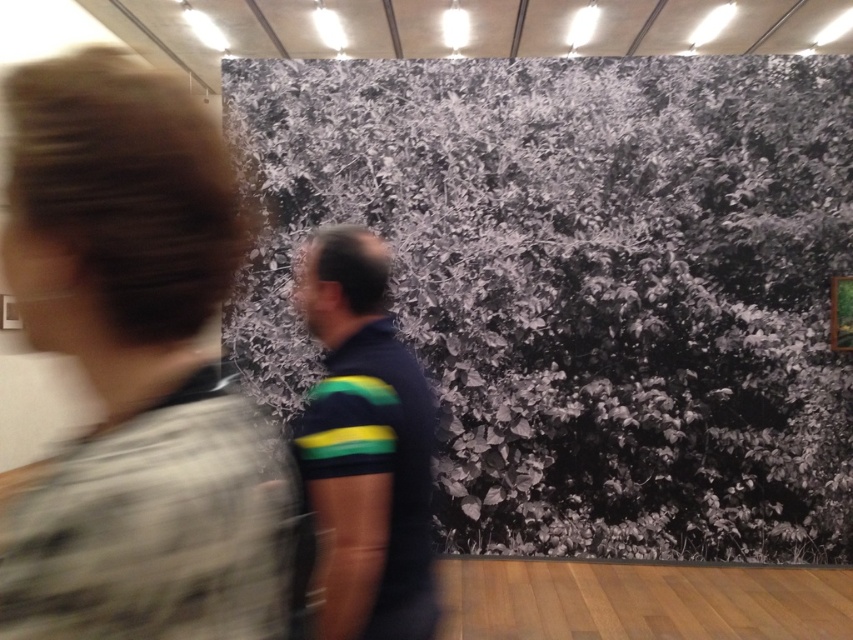
Does blurred hair at center appear under striped polo shirt at center?

No, blurred hair at center is not below striped polo shirt at center.

What do you see at coordinates (136, 369) in the screenshot?
I see `blurred hair at center` at bounding box center [136, 369].

Image resolution: width=853 pixels, height=640 pixels. I want to click on blurred hair at center, so click(x=136, y=369).